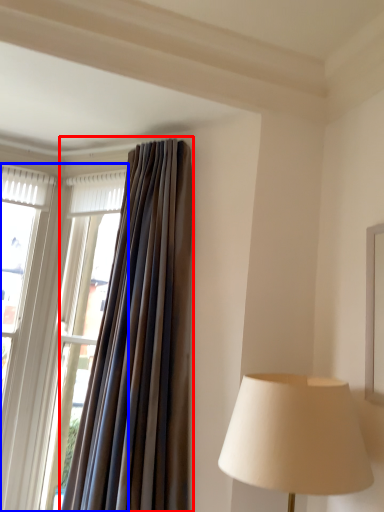
Question: Among these objects, which one is farthest to the camera, curtain (highlighted by a red box) or window (highlighted by a blue box)?

Choices:
 (A) curtain
 (B) window

Answer: (B)